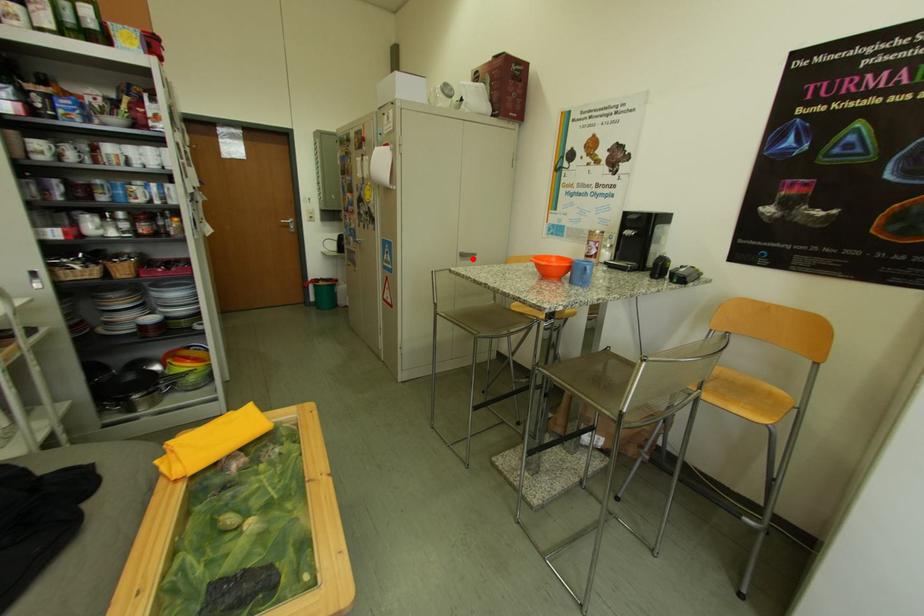
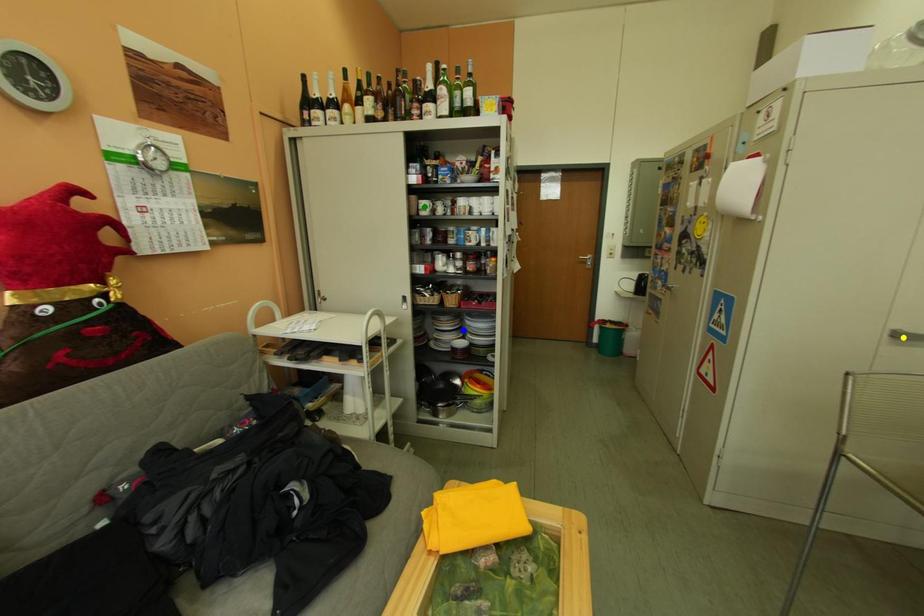
Question: I am providing you with two images of the same scene from different viewpoints. A red point is marked on the first image. You are given multiple points on the second image. In image 2, which mark is for the same physical point as the one in image 1?

Choices:
 (A) yellow point
 (B) green point
 (C) blue point

Answer: (A)